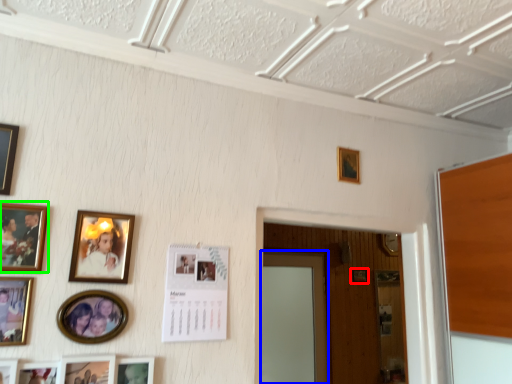
Question: Which object is the closest to the picture frame (highlighted by a red box)? Choose among these: door (highlighted by a blue box) or picture frame (highlighted by a green box).

Choices:
 (A) door
 (B) picture frame

Answer: (A)